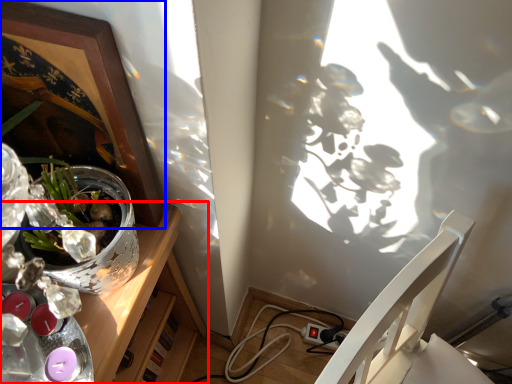
Question: Which object is further to the camera taking this photo, desk (highlighted by a red box) or picture frame (highlighted by a blue box)?

Choices:
 (A) desk
 (B) picture frame

Answer: (A)